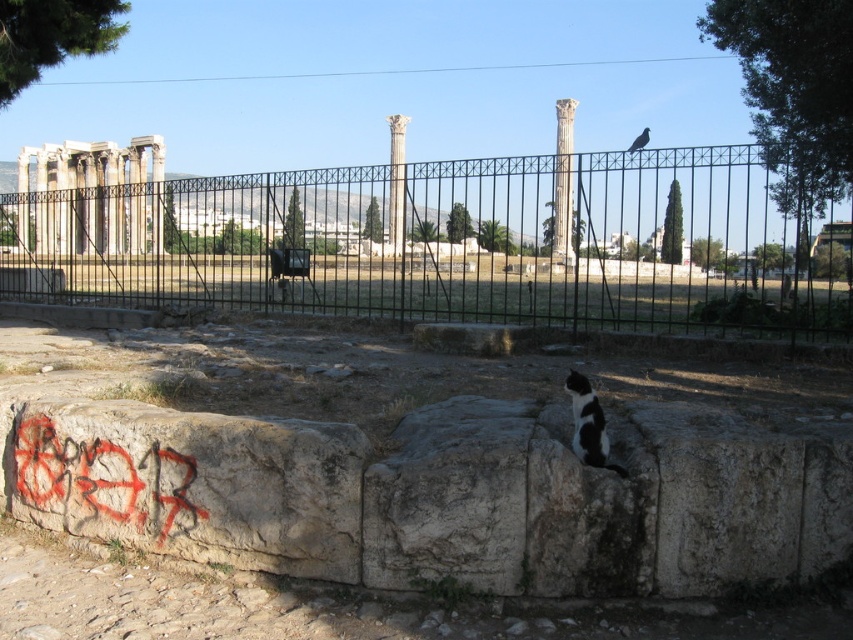
You are standing at the point with coordinates point (563, 180). Looking around, you see a low stone wall with graffiti and a metal fence behind it. Which object are you currently standing on?

You are standing on the smooth white column at center, which is located at point (563, 180).

You are standing in front of the ancient ruins and want to take a photo. There are two points marked in the scene. The first point is at coordinates point (61,216) and the second point is at coordinates point (403,134). Which point is closer to your camera?

Point (61,216) is closer to the camera than point (403,134).

You are an archaeologist examining the ruins. You need to place a protective barrier between the white marble columns at left and the black and white fur cat at center. Given the cat is smaller than the columns, which object requires a wider barrier to cover its entire width?

The white marble columns at left require a wider barrier since their width surpasses that of the black and white fur cat at center.